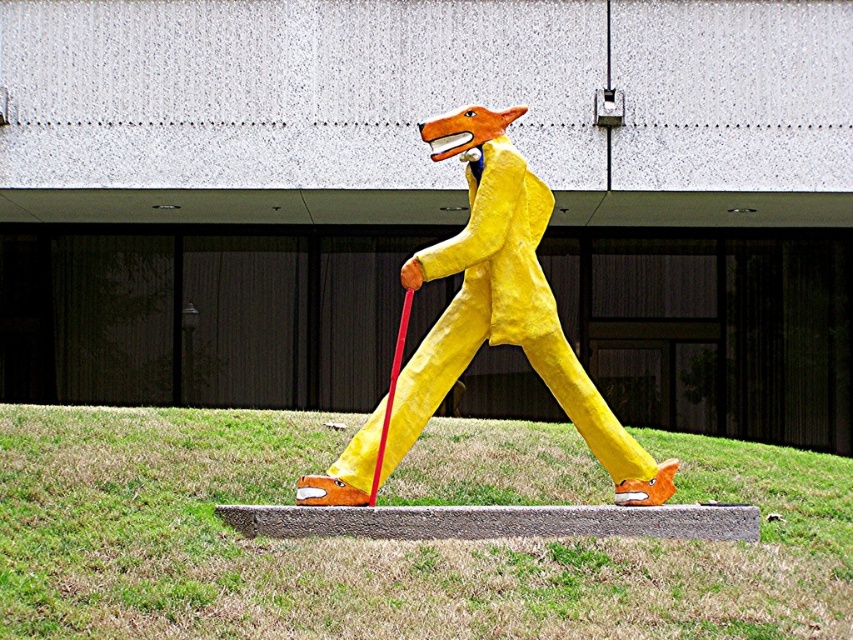
Looking at this image, you are planning to place a small garden ornament that requires a space wider than the green grass at center. Can the yellow paper mache fox at center provide enough space for this?

The green grass at center is narrower than the yellow paper mache fox at center, so the fox is wider. Therefore, the yellow paper mache fox at center can provide sufficient space for the garden ornament requiring a wider area than the green grass at center.

You are standing at the origin point in the image and want to walk to the green grass at center. What are the coordinates you need to move to?

The coordinates to move to are 0.848 in the x direction and 0.448 in the y direction.

You are a gardener who wants to plant flowers in the green grass at center. However, there is a yellow paper mache fox at center in the way. Can you plant flowers directly beneath the fox?

The green grass at center is positioned under the yellow paper mache fox at center, so you can plant flowers directly beneath the fox since the grass is there.